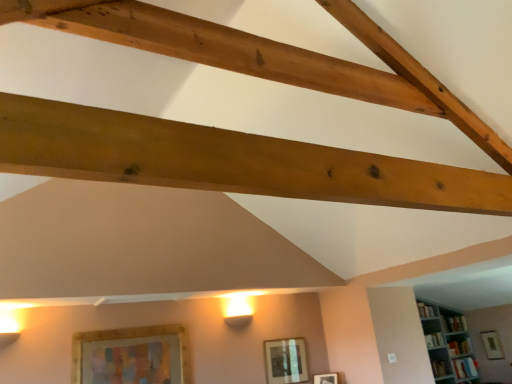
Question: Choose the correct answer: Is white wooden bookshelf at upper right inside wooden framed picture at lower left, which appears as the first picture frame when viewed from the front, or outside it?

Choices:
 (A) outside
 (B) inside

Answer: (A)

Question: Is point (445, 360) closer or farther from the camera than point (181, 380)?

Choices:
 (A) farther
 (B) closer

Answer: (A)

Question: Considering the real-world distances, which object is farthest from the natural wood beam at upper center?

Choices:
 (A) wooden framed picture at lower left, the 4th picture frame from the bottom
 (B) white wooden bookshelf at upper right
 (C) wooden picture frame at upper center, the 1th picture frame when ordered from right to left
 (D) matte wooden picture frame at center, placed as the third picture frame when sorted from left to right
 (E) matte silver picture frame at center, which is the 3th picture frame from right to left

Answer: (C)

Question: Considering the real-world distances, which object is closest to the natural wood beam at upper center?

Choices:
 (A) wooden picture frame at upper center, the fourth picture frame in the left-to-right sequence
 (B) white wooden bookshelf at upper right
 (C) matte wooden picture frame at center, marked as the 2th picture frame in a bottom-to-top arrangement
 (D) matte silver picture frame at center, the 2th picture frame when ordered from front to back
 (E) wooden framed picture at lower left, which appears as the first picture frame when viewed from the front

Answer: (E)